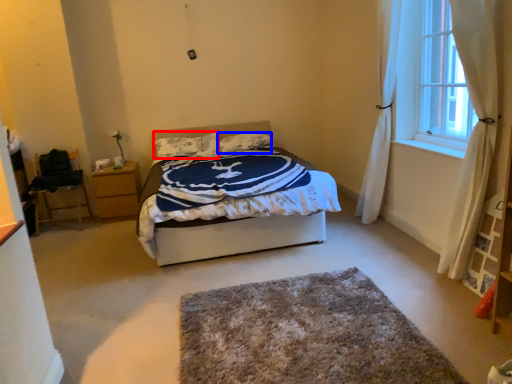
Question: Which object is closer to the camera taking this photo, pillow (highlighted by a red box) or pillow (highlighted by a blue box)?

Choices:
 (A) pillow
 (B) pillow

Answer: (A)